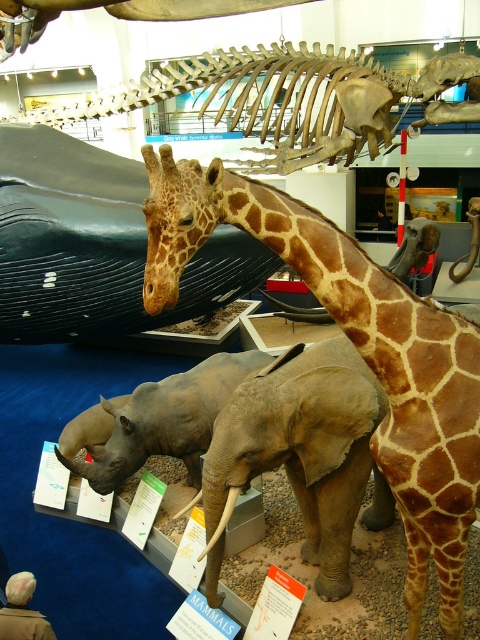
Is the position of brown spotted giraffe at center more distant than that of gray matte elephant at center?

No, brown spotted giraffe at center is in front of gray matte elephant at center.

Is brown spotted giraffe at center closer to camera compared to gray matte elephant at center?

That is True.

This screenshot has width=480, height=640. What do you see at coordinates (357, 348) in the screenshot? I see `brown spotted giraffe at center` at bounding box center [357, 348].

The height and width of the screenshot is (640, 480). Identify the location of brown spotted giraffe at center. (357, 348).